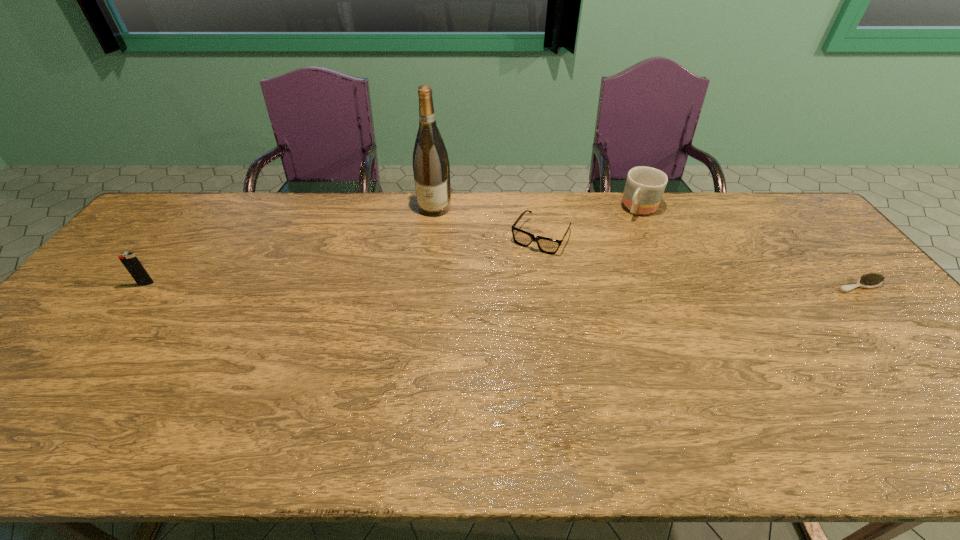
Find the location of a particular element. igniter is located at coordinates (129, 260).

Where is `the rightmost object`? the rightmost object is located at coordinates pos(871,280).

I want to click on scrubbing brush, so click(x=871, y=280).

Locate an element on the screen. mug is located at coordinates (644, 187).

I want to click on the second object from left to right, so click(431, 168).

Find the location of a particular element. This screenshot has height=540, width=960. the tallest object is located at coordinates (431, 168).

Find the location of a particular element. the fourth tallest object is located at coordinates (546, 245).

Locate an element on the screen. This screenshot has width=960, height=540. the third object from right to left is located at coordinates [546, 245].

Where is `vacant space located on the back of the leftmost object`? vacant space located on the back of the leftmost object is located at coordinates (175, 248).

The height and width of the screenshot is (540, 960). I want to click on vacant area situated 0.250m on the back of the scrubbing brush, so click(x=806, y=225).